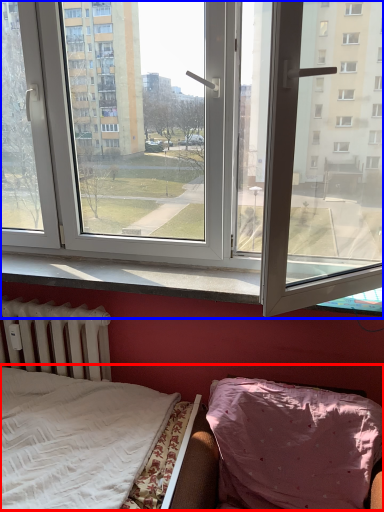
Question: Which of the following is the closest to the observer, hospital bed (highlighted by a red box) or window (highlighted by a blue box)?

Choices:
 (A) hospital bed
 (B) window

Answer: (A)